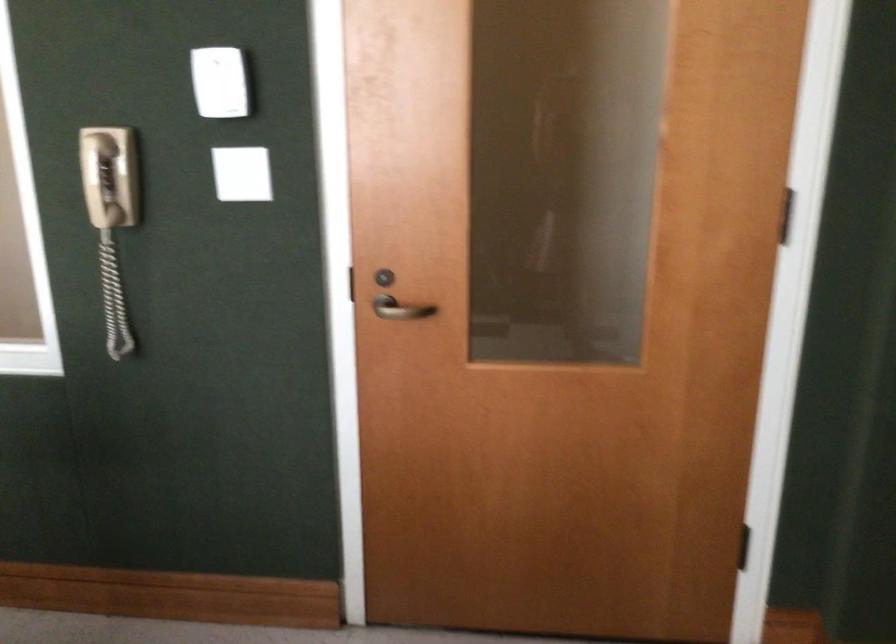
Where would you insert the door lock? Please return your answer as a coordinate pair (x, y).

(346, 283)